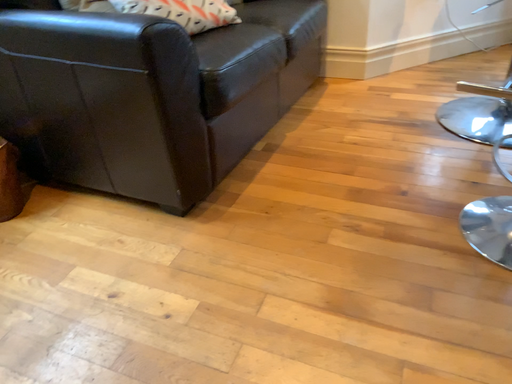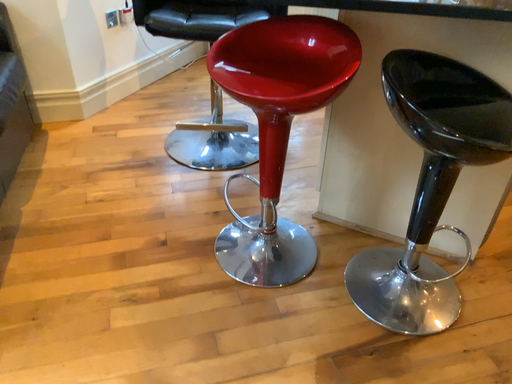
Question: How did the camera likely rotate when shooting the video?

Choices:
 (A) rotated right
 (B) rotated left

Answer: (A)